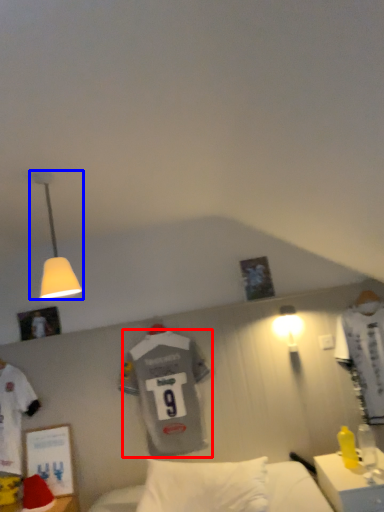
Question: Among these objects, which one is farthest to the camera, t shirt (highlighted by a red box) or lamp (highlighted by a blue box)?

Choices:
 (A) t shirt
 (B) lamp

Answer: (A)